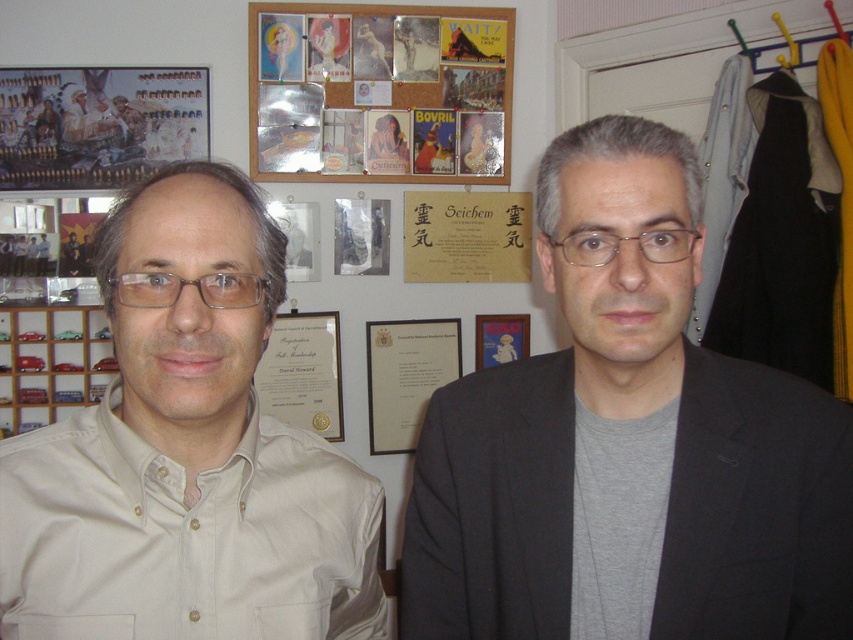
Question: Is corkboard at upper center to the right of white paper certificate at center from the viewer's perspective?

Choices:
 (A) yes
 (B) no

Answer: (A)

Question: Does gray matte suit at center lie behind black paper at center?

Choices:
 (A) yes
 (B) no

Answer: (B)

Question: Which point is farther from the camera taking this photo?

Choices:
 (A) (416, 112)
 (B) (228, 531)

Answer: (A)

Question: Among these points, which one is nearest to the camera?

Choices:
 (A) (302, 220)
 (B) (471, 182)

Answer: (A)

Question: Which point is farther to the camera?

Choices:
 (A) (322, 310)
 (B) (184, 320)
 (C) (476, 346)
 (D) (148, 140)

Answer: (C)

Question: Does wooden framed painting at upper left have a greater width compared to metallic silver picture frame at upper center?

Choices:
 (A) yes
 (B) no

Answer: (A)